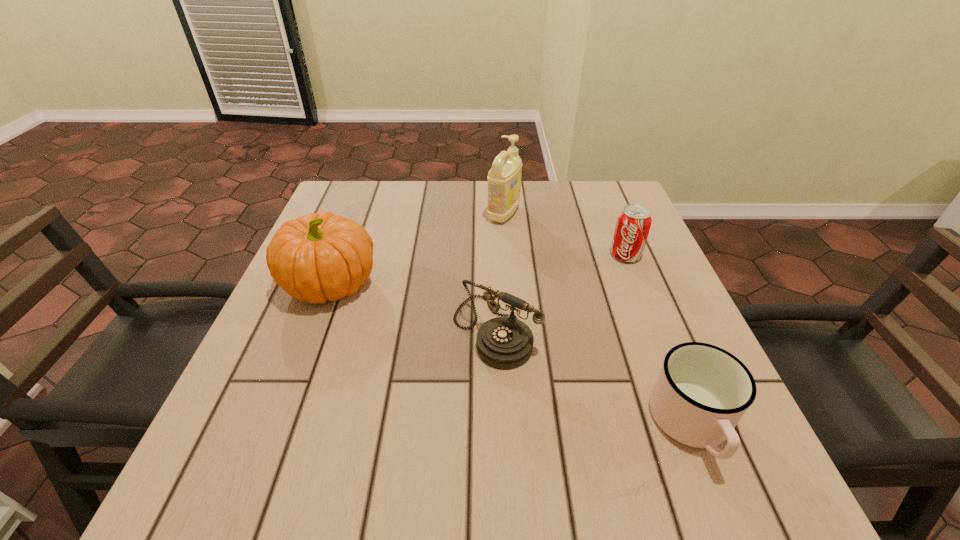
The width and height of the screenshot is (960, 540). Identify the location of unoccupied position between the detergent and the soda. (564, 235).

The height and width of the screenshot is (540, 960). Find the location of `free area in between the leftmost object and the soda`. free area in between the leftmost object and the soda is located at coordinates (479, 269).

Locate an element on the screen. This screenshot has width=960, height=540. empty location between the leftmost object and the soda is located at coordinates click(x=479, y=269).

Where is `vacant area between the telephone and the nearest object`? The width and height of the screenshot is (960, 540). vacant area between the telephone and the nearest object is located at coordinates (594, 377).

I want to click on free space between the farthest object and the mug, so click(x=598, y=320).

This screenshot has width=960, height=540. In order to click on empty location between the farthest object and the nearest object in this screenshot , I will do `click(598, 320)`.

You are a GUI agent. You are given a task and a screenshot of the screen. Output one action in this format:
    pyautogui.click(x=<x>, y=<y>)
    Task: Click on the vacant area between the pumpkin and the farthest object
    
    Given the screenshot: What is the action you would take?
    coord(418,249)

Locate an element on the screen. This screenshot has height=540, width=960. vacant space that's between the telephone and the nearest object is located at coordinates (594, 377).

Locate which object ranks second in proximity to the soda. Please provide its 2D coordinates. Your answer should be formatted as a tuple, i.e. [(x, y)], where the tuple contains the x and y coordinates of a point satisfying the conditions above.

[(505, 343)]

Where is `the third closest object to the farthest object`? This screenshot has width=960, height=540. the third closest object to the farthest object is located at coordinates (318, 257).